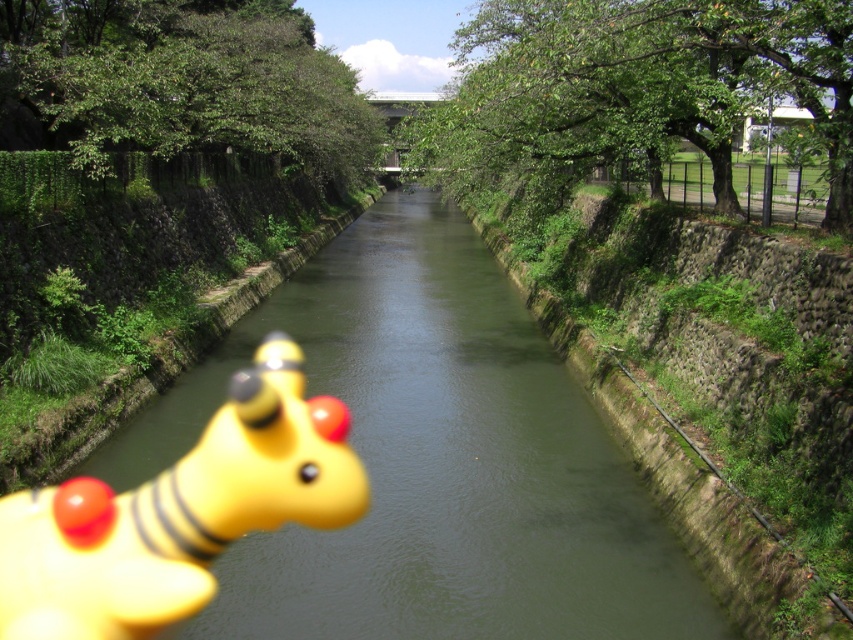
Question: Can you confirm if green stone creek at center is positioned to the left of yellow rubber toy at lower left?

Choices:
 (A) no
 (B) yes

Answer: (A)

Question: Observing the image, what is the correct spatial positioning of green stone creek at center in reference to yellow rubber toy at lower left?

Choices:
 (A) left
 (B) right

Answer: (B)

Question: Which point is closer to the camera taking this photo?

Choices:
 (A) (97, 490)
 (B) (351, 364)

Answer: (A)

Question: In this image, where is green stone creek at center located relative to yellow rubber toy at lower left?

Choices:
 (A) below
 (B) above

Answer: (B)

Question: Which of the following is the farthest from the observer?

Choices:
 (A) (201, 576)
 (B) (386, 285)

Answer: (B)

Question: Which point is closer to the camera?

Choices:
 (A) yellow rubber toy at lower left
 (B) green stone creek at center

Answer: (A)